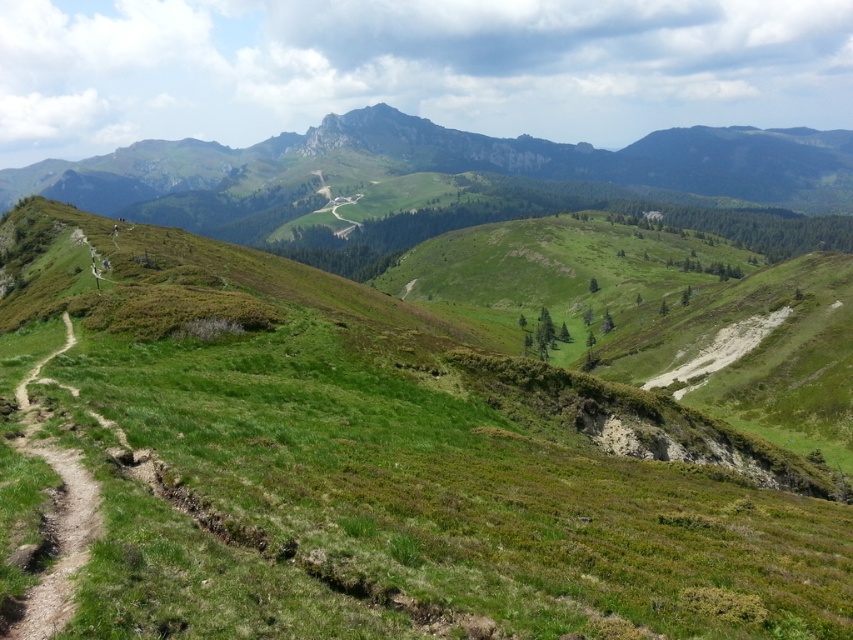
Who is higher up, green grassy at upper center or green grassy hill at upper center?

Positioned higher is green grassy hill at upper center.

Who is positioned more to the left, green grassy at upper center or green grassy hill at upper center?

Positioned to the left is green grassy hill at upper center.

Does point (103, 582) come in front of point (744, 163)?

Yes, point (103, 582) is in front of point (744, 163).

You are a GUI agent. You are given a task and a screenshot of the screen. Output one action in this format:
    pyautogui.click(x=<x>, y=<y>)
    Task: Click on the green grassy at upper center
    The height and width of the screenshot is (640, 853).
    Given the screenshot: What is the action you would take?
    pyautogui.click(x=393, y=460)

Can you confirm if green grassy at upper center is taller than dirt path at left?

Yes, green grassy at upper center is taller than dirt path at left.

Does green grassy at upper center have a lesser height compared to dirt path at left?

In fact, green grassy at upper center may be taller than dirt path at left.

This screenshot has width=853, height=640. Describe the element at coordinates (393, 460) in the screenshot. I see `green grassy at upper center` at that location.

I want to click on green grassy at upper center, so click(393, 460).

Is point (674, 161) positioned before point (73, 609)?

No, (674, 161) is further to viewer.

Does green grassy hill at upper center appear under dirt path at left?

No, green grassy hill at upper center is not below dirt path at left.

What do you see at coordinates (457, 184) in the screenshot? Image resolution: width=853 pixels, height=640 pixels. I see `green grassy hill at upper center` at bounding box center [457, 184].

Identify the location of green grassy hill at upper center. (457, 184).